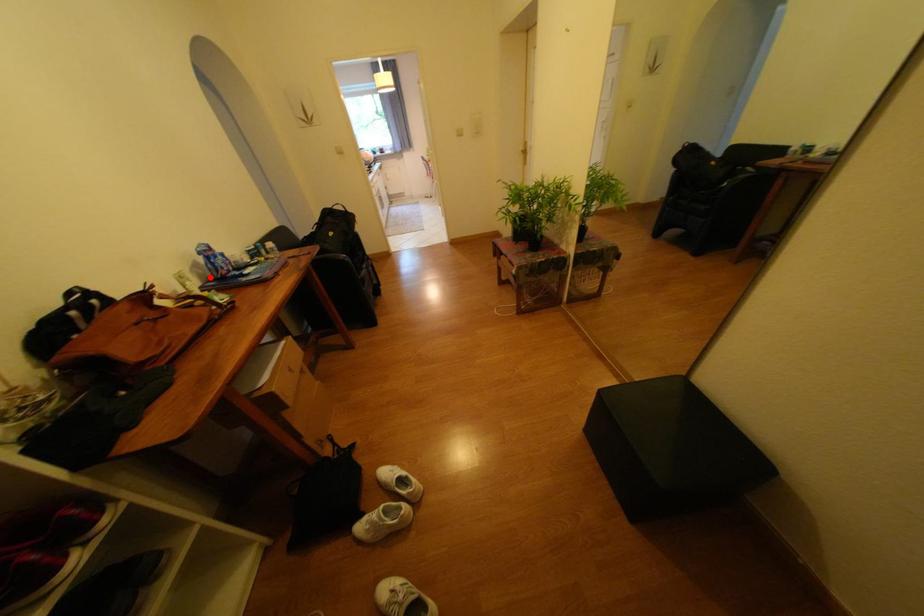
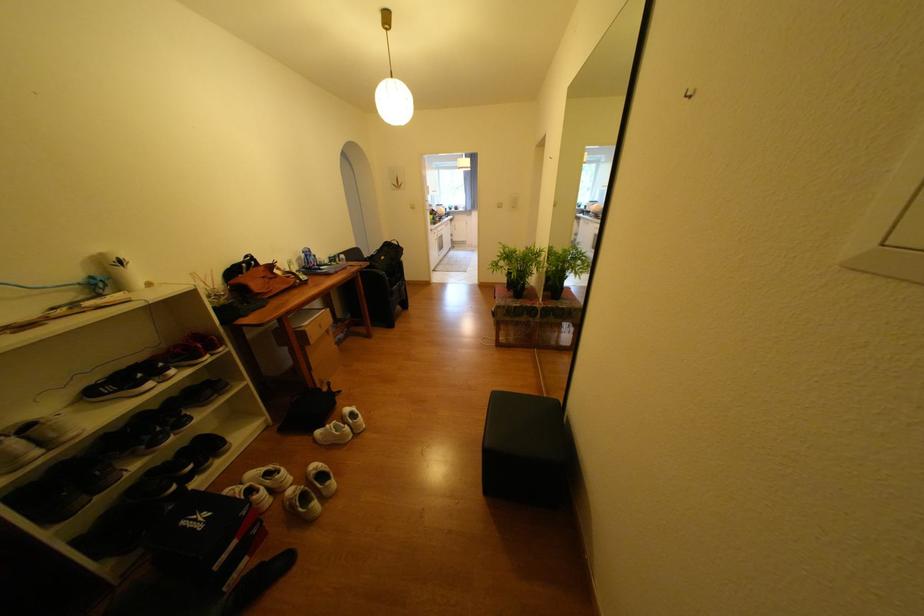
In the second image, find the point that corresponds to the highlighted location in the first image.

(309, 265)